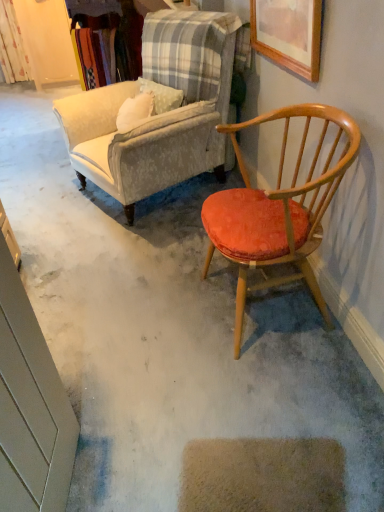
Where is `free spot to the left of wooden armchair with orange cushion at right, placed as the second chair when sorted from back to front`? free spot to the left of wooden armchair with orange cushion at right, placed as the second chair when sorted from back to front is located at coordinates (155, 318).